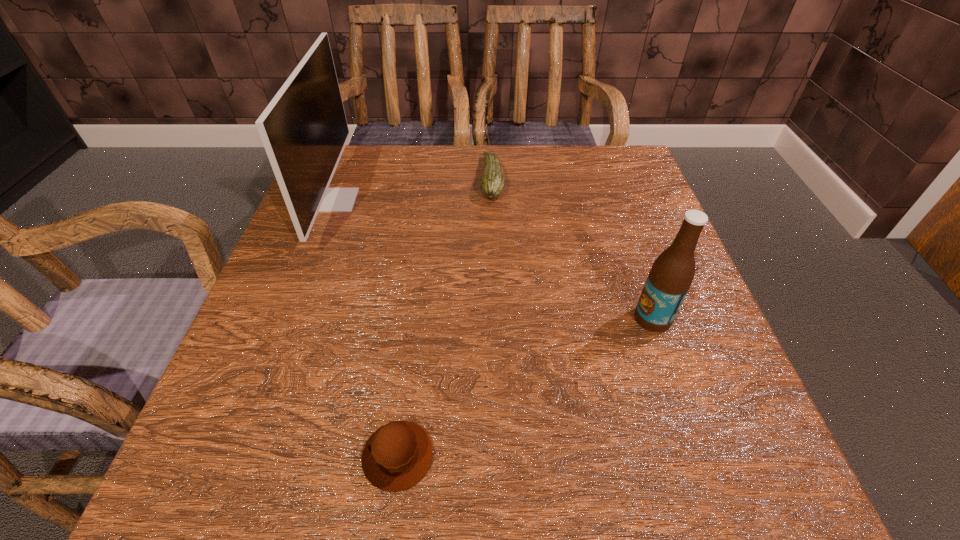
In the image, there is a desktop. At what (x,y) coordinates should I click in order to perform the action: click on blank space at the near edge. Please return your answer as a coordinate pair (x, y). The width and height of the screenshot is (960, 540). Looking at the image, I should click on (514, 495).

Locate an element on the screen. The image size is (960, 540). vacant space at the left edge of the desktop is located at coordinates (335, 248).

You are a GUI agent. You are given a task and a screenshot of the screen. Output one action in this format:
    pyautogui.click(x=<x>, y=<y>)
    Task: Click on the vacant position at the right edge of the desktop
    The height and width of the screenshot is (540, 960).
    Given the screenshot: What is the action you would take?
    point(607,211)

The image size is (960, 540). Identify the location of vacant space at the far left corner of the desktop. (389, 148).

Identify the location of free space at the near left corner. (265, 477).

In the image, there is a desktop. At what (x,y) coordinates should I click in order to perform the action: click on blank space at the near right corner. Please return your answer as a coordinate pair (x, y). The image size is (960, 540). Looking at the image, I should click on (674, 457).

What are the coordinates of `vacant space that's between the nearest object and the second nearest object` in the screenshot? It's located at (525, 387).

Identify the location of free space that is in between the tallest object and the nearest object. The height and width of the screenshot is (540, 960). pos(367,328).

Where is `unoccupied area between the third shortest object and the muffin`? The image size is (960, 540). unoccupied area between the third shortest object and the muffin is located at coordinates (525, 387).

Locate an element on the screen. The image size is (960, 540). vacant point located between the tallest object and the third shortest object is located at coordinates (493, 259).